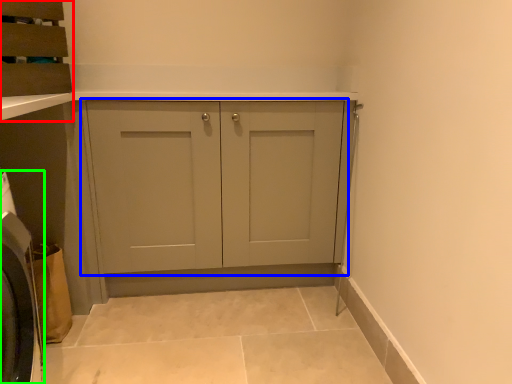
Question: Based on their relative distances, which object is nearer to cabinetry (highlighted by a red box)? Choose from cupboard (highlighted by a blue box) and washing machine (highlighted by a green box).

Choices:
 (A) cupboard
 (B) washing machine

Answer: (B)